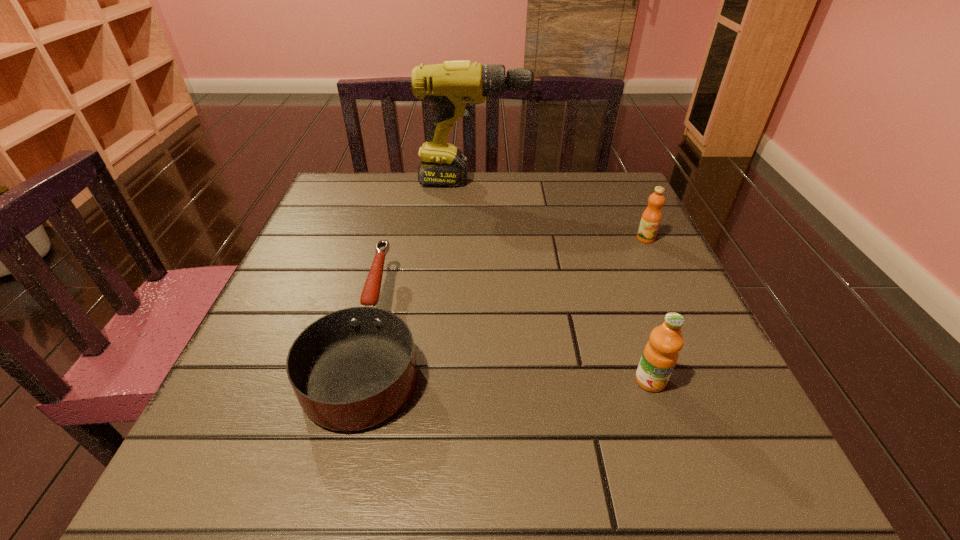
Locate an element on the screen. free point located on the handle side of the shortest object is located at coordinates (403, 205).

This screenshot has height=540, width=960. Find the location of `vacant space located 0.210m on the handle side of the shortest object`. vacant space located 0.210m on the handle side of the shortest object is located at coordinates (402, 211).

Where is `free space located 0.260m on the handle side of the shortest object`? This screenshot has width=960, height=540. free space located 0.260m on the handle side of the shortest object is located at coordinates (404, 200).

The height and width of the screenshot is (540, 960). Identify the location of object that is at the far edge. (454, 86).

Find the location of a particular element. The height and width of the screenshot is (540, 960). object located in the left edge section of the desktop is located at coordinates (352, 369).

This screenshot has width=960, height=540. In the image, there is a desktop. What are the coordinates of `vacant area at the far edge` in the screenshot? It's located at (552, 213).

Locate an element on the screen. Image resolution: width=960 pixels, height=540 pixels. vacant space at the near edge is located at coordinates (468, 454).

You are a GUI agent. You are given a task and a screenshot of the screen. Output one action in this format:
    pyautogui.click(x=<x>, y=<y>)
    Task: Click on the free space at the left edge of the desktop
    This screenshot has width=960, height=540.
    Given the screenshot: What is the action you would take?
    (291, 267)

The width and height of the screenshot is (960, 540). In order to click on vacant space at the right edge in this screenshot , I will do `click(637, 251)`.

What are the coordinates of `free space at the near left corner of the desktop` in the screenshot? It's located at (277, 497).